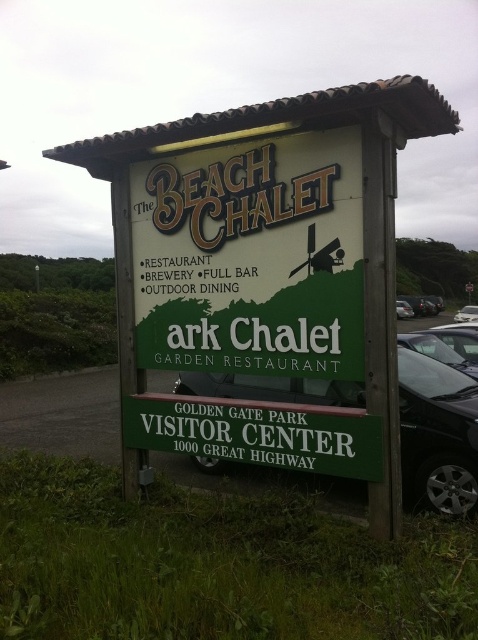
Which is above, black glossy car at center or silver metallic car at right?

silver metallic car at right is above.

Between point (474, 310) and point (399, 317), which one is positioned in front?

Point (474, 310)

Does point (469, 305) come closer to viewer compared to point (399, 301)?

Yes, point (469, 305) is in front of point (399, 301).

The image size is (478, 640). I want to click on black glossy car at center, so click(467, 314).

Who is positioned more to the right, green matte signboard at center or black glossy car at lower right?

black glossy car at lower right is more to the right.

Is green matte signboard at center taller than black glossy car at lower right?

Yes, green matte signboard at center is taller than black glossy car at lower right.

The image size is (478, 640). What do you see at coordinates (251, 257) in the screenshot?
I see `green matte signboard at center` at bounding box center [251, 257].

Find the location of a particular element. green matte signboard at center is located at coordinates (251, 257).

Is green wooden signboard at center wider than silver metallic car at right?

Yes, green wooden signboard at center is wider than silver metallic car at right.

The image size is (478, 640). Identify the location of green wooden signboard at center. (63, 413).

The image size is (478, 640). In order to click on green wooden signboard at center in this screenshot , I will do pos(63,413).